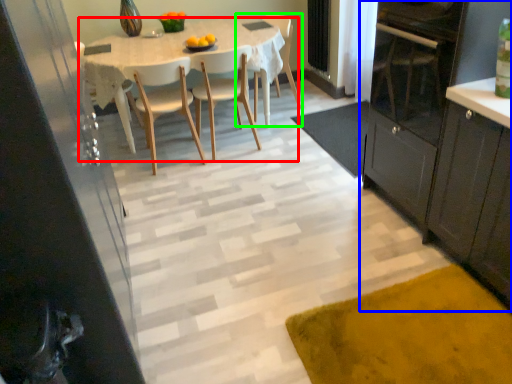
Question: Based on their relative distances, which object is nearer to kitchen & dining room table (highlighted by a red box)? Choose from cabinetry (highlighted by a blue box) and chair (highlighted by a green box).

Choices:
 (A) cabinetry
 (B) chair

Answer: (B)